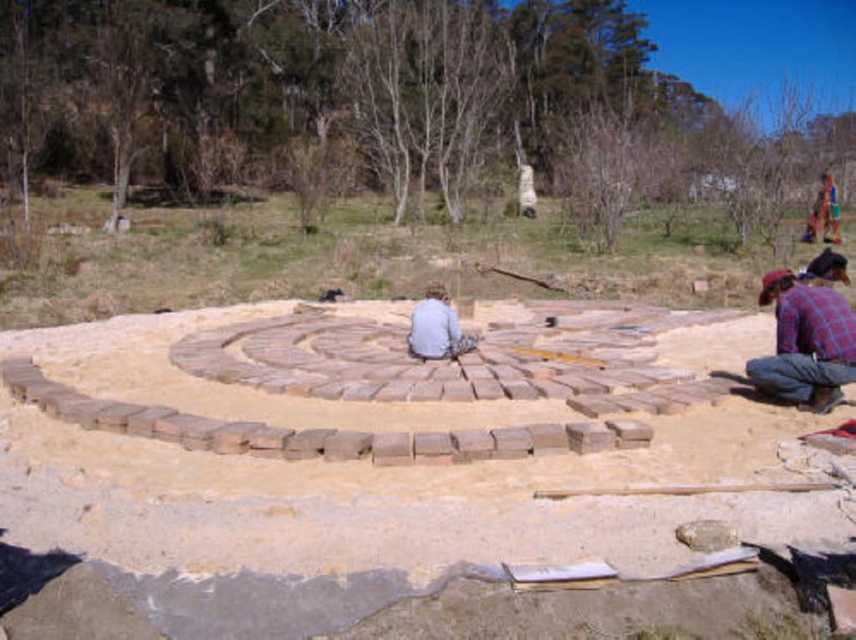
Question: In this image, where is brown brick maze at center located relative to plaid fabric shirt at lower right?

Choices:
 (A) right
 (B) left

Answer: (B)

Question: From the image, what is the correct spatial relationship of brown brick maze at center in relation to plaid fabric shirt at lower right?

Choices:
 (A) right
 (B) left

Answer: (B)

Question: Which is farther from the plaid fabric shirt at lower right?

Choices:
 (A) light gray fabric at center
 (B) brown brick maze at center

Answer: (A)

Question: Which object is farther from the camera taking this photo?

Choices:
 (A) light gray fabric at center
 (B) plaid fabric shirt at lower right

Answer: (A)

Question: Considering the relative positions of brown brick maze at center and plaid fabric shirt at lower right in the image provided, where is brown brick maze at center located with respect to plaid fabric shirt at lower right?

Choices:
 (A) above
 (B) below

Answer: (B)

Question: Among these points, which one is nearest to the camera?

Choices:
 (A) (438, 339)
 (B) (786, 317)
 (C) (318, 570)

Answer: (C)